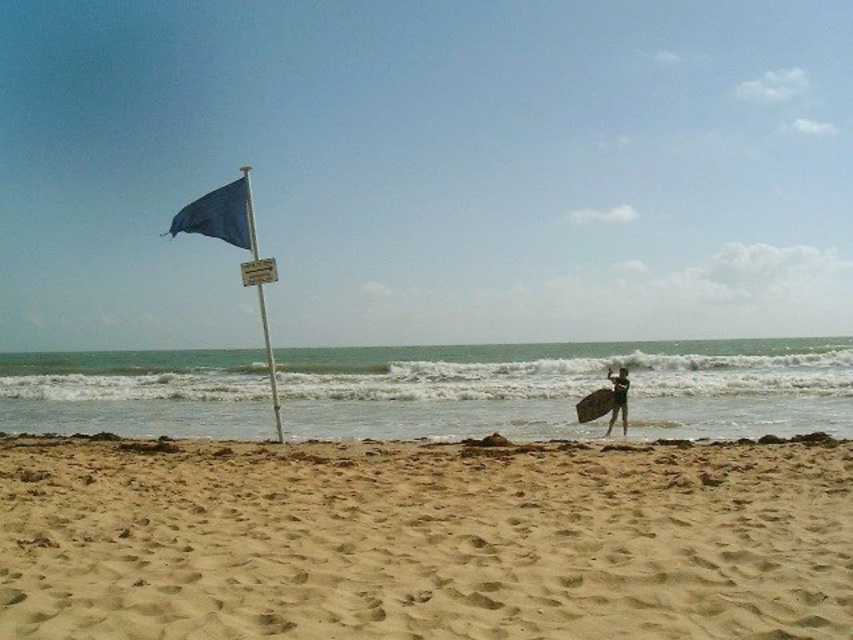
You are standing at the point marked as point (606, 394) on the beach. You want to walk straight towards the flagpole on the left. How far will you have to walk to reach the flagpole?

The distance between point (606, 394) and the viewer is 19.61 meters. Since you are at point (606, 394) and want to walk towards the flagpole on the left, you will need to walk approximately 19.61 meters to reach the flagpole.

You are a surfer who just arrived at the beach and see the brown wooden surfboard at right and the black matte surfboard at right. Which one is closer to you?

The brown wooden surfboard at right is closer to you because the black matte surfboard at right is behind it.